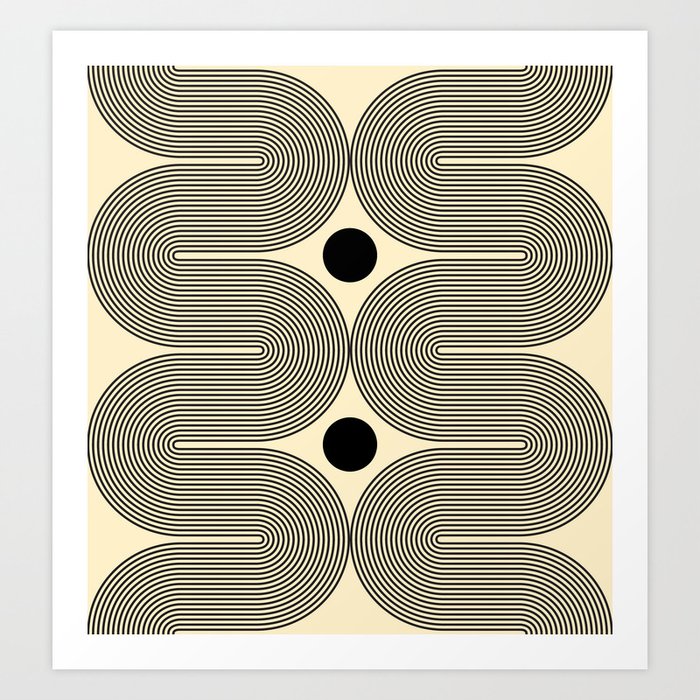
Where is `picture`? picture is located at coordinates (524, 458).